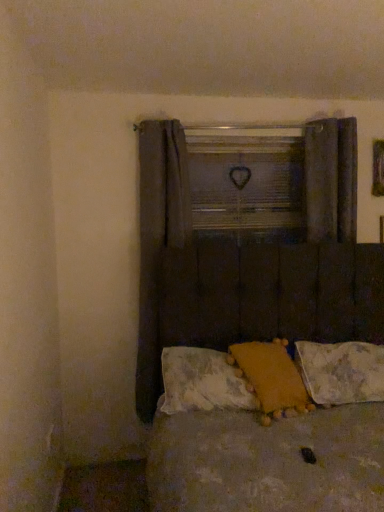
Question: Is fluffy yellow pillow at center, placed as the 3th pillow when sorted from right to left, oriented towards brown tufted headboard at center?

Choices:
 (A) yes
 (B) no

Answer: (A)

Question: From a real-world perspective, is fluffy yellow pillow at center, placed as the 3th pillow when sorted from right to left, physically below brown tufted headboard at center?

Choices:
 (A) no
 (B) yes

Answer: (A)

Question: Is fluffy yellow pillow at center, which ranks as the first pillow in left-to-right order, positioned far away from brown tufted headboard at center?

Choices:
 (A) yes
 (B) no

Answer: (B)

Question: Is fluffy yellow pillow at center, which ranks as the first pillow in left-to-right order, shorter than brown tufted headboard at center?

Choices:
 (A) yes
 (B) no

Answer: (A)

Question: From a real-world perspective, is fluffy yellow pillow at center, placed as the 3th pillow when sorted from right to left, on top of brown tufted headboard at center?

Choices:
 (A) yes
 (B) no

Answer: (A)

Question: Considering the relative sizes of fluffy yellow pillow at center, which ranks as the first pillow in left-to-right order, and brown tufted headboard at center in the image provided, is fluffy yellow pillow at center, which ranks as the first pillow in left-to-right order, smaller than brown tufted headboard at center?

Choices:
 (A) no
 (B) yes

Answer: (B)

Question: Is fluffy yellow pillow at center, arranged as the second pillow when viewed from the left, behind fluffy yellow pillow at center, placed as the 3th pillow when sorted from right to left?

Choices:
 (A) yes
 (B) no

Answer: (B)

Question: Does fluffy yellow pillow at center, arranged as the second pillow when viewed from the right, have a greater width compared to fluffy yellow pillow at center, placed as the 3th pillow when sorted from right to left?

Choices:
 (A) yes
 (B) no

Answer: (A)

Question: Does fluffy yellow pillow at center, arranged as the second pillow when viewed from the right, contain fluffy yellow pillow at center, placed as the 3th pillow when sorted from right to left?

Choices:
 (A) yes
 (B) no

Answer: (A)

Question: From a real-world perspective, is fluffy yellow pillow at center, arranged as the second pillow when viewed from the right, on fluffy yellow pillow at center, placed as the 3th pillow when sorted from right to left?

Choices:
 (A) yes
 (B) no

Answer: (A)

Question: Does fluffy yellow pillow at center, arranged as the second pillow when viewed from the left, appear on the right side of fluffy yellow pillow at center, which ranks as the first pillow in left-to-right order?

Choices:
 (A) no
 (B) yes

Answer: (B)

Question: Is fluffy yellow pillow at center, arranged as the second pillow when viewed from the right, turned away from fluffy yellow pillow at center, placed as the 3th pillow when sorted from right to left?

Choices:
 (A) no
 (B) yes

Answer: (B)

Question: Can you confirm if dark fabric curtain at right, the first curtain viewed from the right, is thinner than dark fabric curtain at left, the 1th curtain from the left?

Choices:
 (A) no
 (B) yes

Answer: (B)